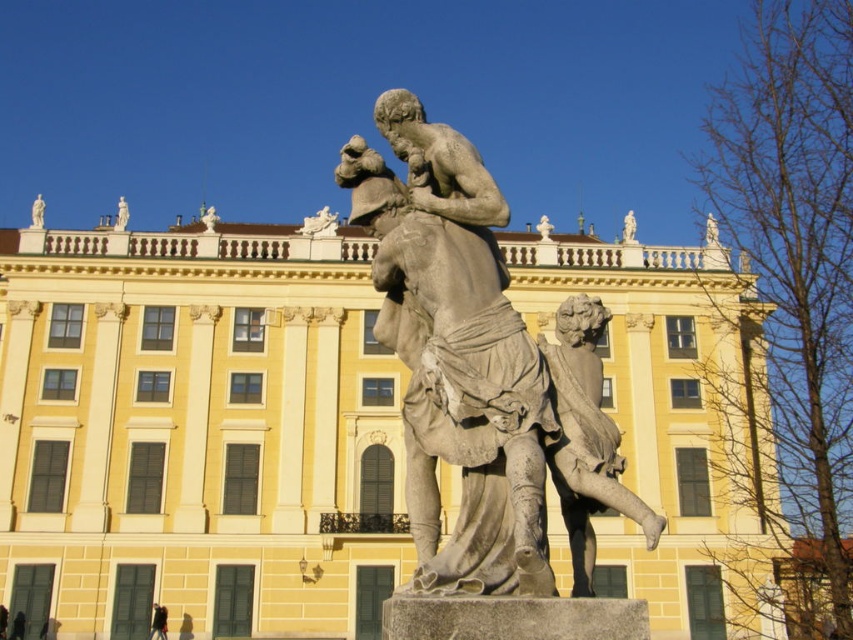
Question: Which object appears closest to the camera in this image?

Choices:
 (A) yellow stone building at center
 (B) gray stone statue at center

Answer: (B)

Question: Which point appears closest to the camera in this image?

Choices:
 (A) (347, 548)
 (B) (456, 428)

Answer: (B)

Question: Does yellow stone building at center have a lesser width compared to gray stone statue at center?

Choices:
 (A) no
 (B) yes

Answer: (A)

Question: Can you confirm if yellow stone building at center is smaller than gray stone statue at center?

Choices:
 (A) no
 (B) yes

Answer: (A)

Question: Is yellow stone building at center smaller than gray stone statue at center?

Choices:
 (A) yes
 (B) no

Answer: (B)